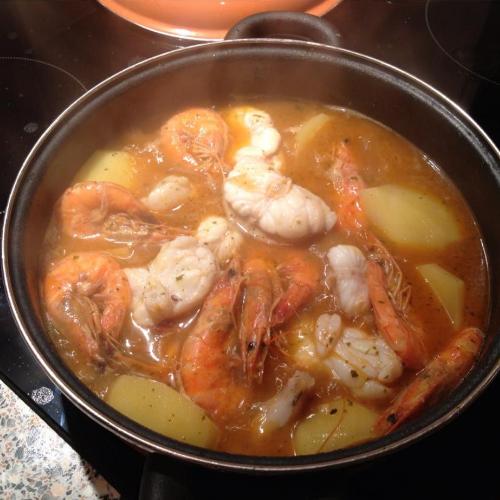
What are the coordinates of `ceramic bowl` in the screenshot? It's located at (207, 16).